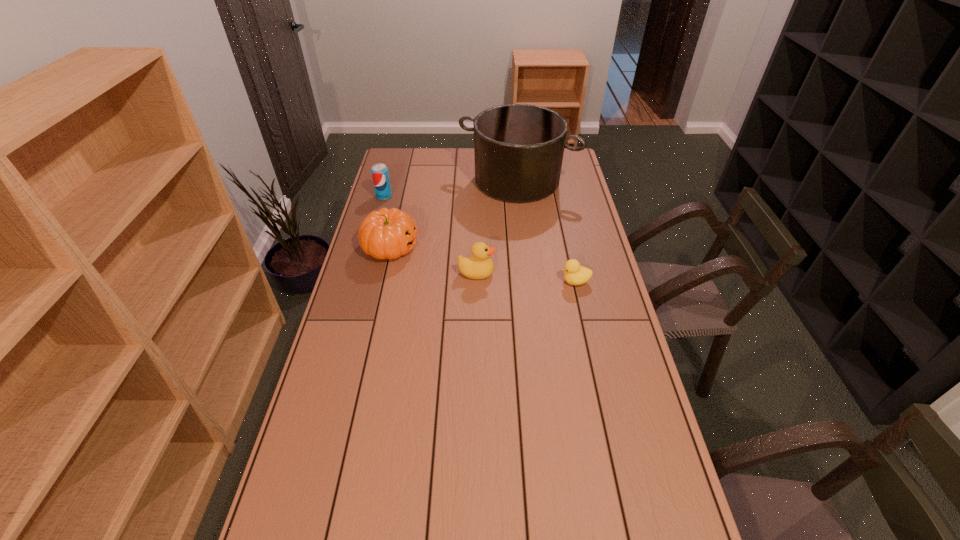
The width and height of the screenshot is (960, 540). I want to click on free space located 0.150m on the front-facing side of the shortest object, so click(x=518, y=281).

Where is `vacant space located on the front-facing side of the shortest object`? vacant space located on the front-facing side of the shortest object is located at coordinates (485, 281).

At what (x,y) coordinates should I click in order to perform the action: click on vacant region located on the front-facing side of the shortest object. Please return your answer as a coordinate pair (x, y). This screenshot has height=540, width=960. Looking at the image, I should click on (533, 281).

Image resolution: width=960 pixels, height=540 pixels. I want to click on object that is at the far edge, so click(518, 148).

Find the location of a particular element. The width and height of the screenshot is (960, 540). pumpkin that is at the left edge is located at coordinates (386, 233).

At what (x,y) coordinates should I click in order to perform the action: click on soda can that is at the left edge. Please return your answer as a coordinate pair (x, y). This screenshot has width=960, height=540. Looking at the image, I should click on (380, 176).

Identify the location of pan at the right edge. (518, 148).

This screenshot has width=960, height=540. In order to click on duck located at the right edge in this screenshot , I will do `click(574, 274)`.

The image size is (960, 540). I want to click on object at the far right corner, so click(x=518, y=148).

Find the location of a particular element. The image size is (960, 540). vacant space at the left edge of the desktop is located at coordinates (388, 208).